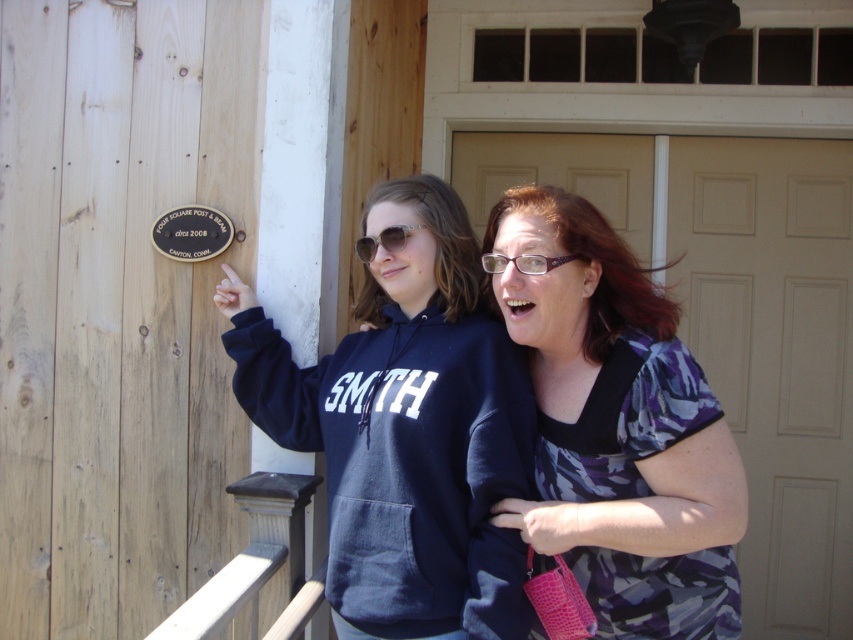
The height and width of the screenshot is (640, 853). What are the coordinates of `navy blue hoodie at center` in the screenshot? It's located at (405, 429).

Who is positioned more to the left, navy blue hoodie at center or clear plastic glasses at upper center?

Positioned to the left is navy blue hoodie at center.

Which is in front, point (489, 444) or point (526, 257)?

Point (526, 257)

The width and height of the screenshot is (853, 640). Find the location of `navy blue hoodie at center`. navy blue hoodie at center is located at coordinates (405, 429).

Who is higher up, camouflage fabric blouse at center or clear plastic glasses at upper center?

Positioned higher is clear plastic glasses at upper center.

Between point (570, 276) and point (489, 268), which one is positioned behind?

Point (489, 268)

The width and height of the screenshot is (853, 640). I want to click on camouflage fabric blouse at center, so click(618, 429).

Does white matte door at center have a smaller size compared to sunglasses at center?

No, white matte door at center is not smaller than sunglasses at center.

Who is more forward, (x=776, y=458) or (x=363, y=250)?

Point (x=363, y=250) is more forward.

This screenshot has width=853, height=640. Find the location of `white matte door at center`. white matte door at center is located at coordinates (775, 356).